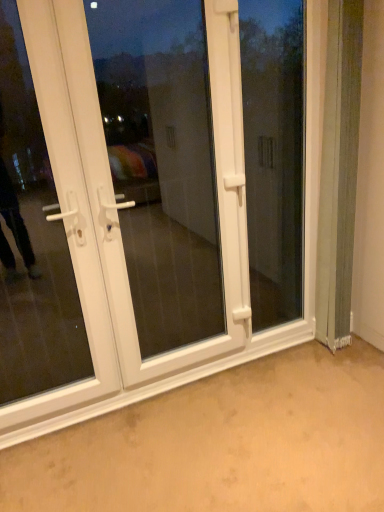
Question: Is white plastic door at left, which is the second door from right to left, inside or outside of transparent glass window at center?

Choices:
 (A) inside
 (B) outside

Answer: (B)

Question: From the image's perspective, is white plastic door at left, which ranks as the first door in left-to-right order, positioned above or below transparent glass window at center?

Choices:
 (A) below
 (B) above

Answer: (A)

Question: Which is farther from the white plastic door at center, the 1th door when ordered from right to left?

Choices:
 (A) white plastic screen door at center
 (B) transparent glass window at center
 (C) white plastic door at left, which is the second door from right to left

Answer: (A)

Question: Which is nearer to the transparent glass window at center?

Choices:
 (A) white plastic screen door at center
 (B) white plastic door at center, the 1th door when ordered from right to left
 (C) white plastic door at left, which ranks as the first door in left-to-right order

Answer: (B)